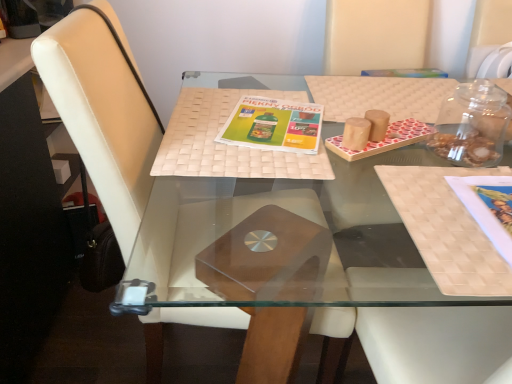
Locate an element on the screen. Image resolution: width=512 pixels, height=384 pixels. white leather chair at center is located at coordinates (102, 110).

This screenshot has width=512, height=384. Describe the element at coordinates (102, 110) in the screenshot. I see `white leather chair at center` at that location.

Measure the distance between point (260, 133) and camera.

The depth of point (260, 133) is 36.30 inches.

Measure the distance between point (231, 150) and camera.

Point (231, 150) is 33.15 inches from camera.

You are a GUI agent. You are given a task and a screenshot of the screen. Output one action in this format:
    pyautogui.click(x=<x>, y=<y>)
    Task: Click on the matte paper book cover at right, which is the 1th book cover in right-to-left order
    
    Given the screenshot: What is the action you would take?
    pyautogui.click(x=488, y=207)

Measure the distance from matte paper book cover at right, which is the 1th book cover in right-to-left order, to white leather chair at center.

Result: The distance of matte paper book cover at right, which is the 1th book cover in right-to-left order, from white leather chair at center is 55.48 centimeters.

Considering the sizes of objects matte paper book cover at right, positioned as the 2th book cover in left-to-right order, and white leather chair at center in the image provided, who is smaller, matte paper book cover at right, positioned as the 2th book cover in left-to-right order, or white leather chair at center?

matte paper book cover at right, positioned as the 2th book cover in left-to-right order.

This screenshot has height=384, width=512. I want to click on book cover that is the 2nd object above the white leather chair at center (from a real-world perspective), so click(x=488, y=207).

Is the depth of woven beige placemat at center greater than that of green matte magazine at center, arranged as the 2th book cover when ordered from the bottom?

No, it is not.

Where is `place mat in front of the green matte magazine at center, which ranks as the first book cover in back-to-front order`? The height and width of the screenshot is (384, 512). place mat in front of the green matte magazine at center, which ranks as the first book cover in back-to-front order is located at coordinates (226, 144).

Can you confirm if woven beige placemat at center is positioned to the left of green matte magazine at center, arranged as the 2th book cover when ordered from the bottom?

Correct, you'll find woven beige placemat at center to the left of green matte magazine at center, arranged as the 2th book cover when ordered from the bottom.

In terms of height, does woven beige placemat at center look taller or shorter compared to green matte magazine at center, arranged as the 2th book cover when ordered from the bottom?

woven beige placemat at center is taller than green matte magazine at center, arranged as the 2th book cover when ordered from the bottom.

Is transparent glass jar at upper right positioned with its back to matte paper book cover at right, placed as the 1th book cover when sorted from front to back?

No.

Is transparent glass jar at upper right located outside matte paper book cover at right, placed as the 1th book cover when sorted from front to back?

That's correct, transparent glass jar at upper right is outside of matte paper book cover at right, placed as the 1th book cover when sorted from front to back.

From a real-world perspective, which is physically below, transparent glass jar at upper right or matte paper book cover at right, which is the 1th book cover in right-to-left order?

In real-world perspective, matte paper book cover at right, which is the 1th book cover in right-to-left order, is lower.

Between matte paper book cover at right, acting as the second book cover starting from the back, and transparent glass jar at upper right, which one has larger size?

With larger size is matte paper book cover at right, acting as the second book cover starting from the back.

In the image, is matte paper book cover at right, which appears as the first book cover when ordered from the bottom, positioned in front of or behind transparent glass jar at upper right?

matte paper book cover at right, which appears as the first book cover when ordered from the bottom, is in front of transparent glass jar at upper right.

Which of these two, matte paper book cover at right, acting as the second book cover starting from the back, or transparent glass jar at upper right, is wider?

matte paper book cover at right, acting as the second book cover starting from the back.

In the scene shown: Which is nearer, (479, 196) or (486, 99)?

Point (479, 196) is closer to the camera than point (486, 99).

From the image's perspective, is white leather chair at center over wooden tray at center?

Yes, from the image's perspective, white leather chair at center is over wooden tray at center.

From a real-world perspective, between white leather chair at center and wooden tray at center, who is vertically higher?

white leather chair at center, from a real-world perspective.

Which object is wider, white leather chair at center or wooden tray at center?

With larger width is wooden tray at center.

Is white leather chair at center not close to wooden tray at center?

No, white leather chair at center is not far away from wooden tray at center.

Consider the image. Is white leather chair at center looking in the opposite direction of green matte magazine at center, which is the first book cover from top to bottom?

Yes, white leather chair at center is positioned with its back facing green matte magazine at center, which is the first book cover from top to bottom.

Are white leather chair at center and green matte magazine at center, which is the 2th book cover in right-to-left order, located far from each other?

No, white leather chair at center is not far away from green matte magazine at center, which is the 2th book cover in right-to-left order.

Is white leather chair at center taller than green matte magazine at center, arranged as the second book cover when viewed from the front?

Correct, white leather chair at center is much taller as green matte magazine at center, arranged as the second book cover when viewed from the front.

Is white leather chair at center wider than green matte magazine at center, which is the first book cover from top to bottom?

Correct, the width of white leather chair at center exceeds that of green matte magazine at center, which is the first book cover from top to bottom.

How many degrees apart are the facing directions of green matte magazine at center, which appears as the first book cover when viewed from the left, and transparent glass jar at upper right?

The angle between the facing direction of green matte magazine at center, which appears as the first book cover when viewed from the left, and the facing direction of transparent glass jar at upper right is 15.2 degrees.

Is green matte magazine at center, arranged as the second book cover when viewed from the front, with transparent glass jar at upper right?

No, green matte magazine at center, arranged as the second book cover when viewed from the front, is not in contact with transparent glass jar at upper right.

Between point (292, 113) and point (472, 151), which one is positioned behind?

The point (292, 113) is behind.

From the image's perspective, which one is positioned lower, green matte magazine at center, arranged as the 2th book cover when ordered from the bottom, or transparent glass jar at upper right?

transparent glass jar at upper right is shown below in the image.

Locate an element on the screen. chair below the matte paper book cover at right, which is the 1th book cover in right-to-left order (from a real-world perspective) is located at coordinates pos(102,110).

I want to click on book cover that is above the woven beige placemat at center (from the image's perspective), so click(x=273, y=125).

Based on the photo, looking at the image, which one is located further to green matte magazine at center, arranged as the second book cover when viewed from the front, matte paper book cover at right, positioned as the 2th book cover in left-to-right order, or woven beige placemat at center?

Among the two, matte paper book cover at right, positioned as the 2th book cover in left-to-right order, is located further to green matte magazine at center, arranged as the second book cover when viewed from the front.

Based on their spatial positions, is wooden tray at center or matte paper book cover at right, acting as the second book cover starting from the back, closer to white leather chair at center?

The object closer to white leather chair at center is wooden tray at center.

When comparing their distances from wooden tray at center, does green matte magazine at center, which appears as the first book cover when viewed from the left, or matte paper book cover at right, acting as the second book cover starting from the back, seem further?

matte paper book cover at right, acting as the second book cover starting from the back, is positioned further to the anchor wooden tray at center.

From the image, which object appears to be farther from wooden tray at center, green matte magazine at center, arranged as the 2th book cover when ordered from the bottom, or woven beige placemat at center?

green matte magazine at center, arranged as the 2th book cover when ordered from the bottom, lies further to wooden tray at center than the other object.

Looking at the image, which one is located closer to woven beige placemat at center, white leather chair at center or matte paper book cover at right, which appears as the first book cover when ordered from the bottom?

The object closer to woven beige placemat at center is white leather chair at center.

When comparing their distances from green matte magazine at center, which appears as the first book cover when viewed from the left, does matte paper book cover at right, placed as the 1th book cover when sorted from front to back, or white leather chair at center seem further?

matte paper book cover at right, placed as the 1th book cover when sorted from front to back.

Based on their spatial positions, is white leather chair at center or transparent glass jar at upper right closer to wooden tray at center?

white leather chair at center.

From the image, which object appears to be farther from transparent glass jar at upper right, woven beige placemat at center or wooden tray at center?

woven beige placemat at center is further to transparent glass jar at upper right.

The width and height of the screenshot is (512, 384). Identify the location of book cover located between woven beige placemat at center and matte paper book cover at right, which is the 1th book cover in right-to-left order, in the left-right direction. tap(273, 125).

I want to click on table situated between white leather chair at center and transparent glass jar at upper right from left to right, so click(274, 191).

Identify the location of place mat between white leather chair at center and transparent glass jar at upper right in the horizontal direction. Image resolution: width=512 pixels, height=384 pixels. (226, 144).

Locate an element on the screen. This screenshot has width=512, height=384. table situated between white leather chair at center and matte paper book cover at right, which is the 1th book cover in right-to-left order, from left to right is located at coordinates (274, 191).